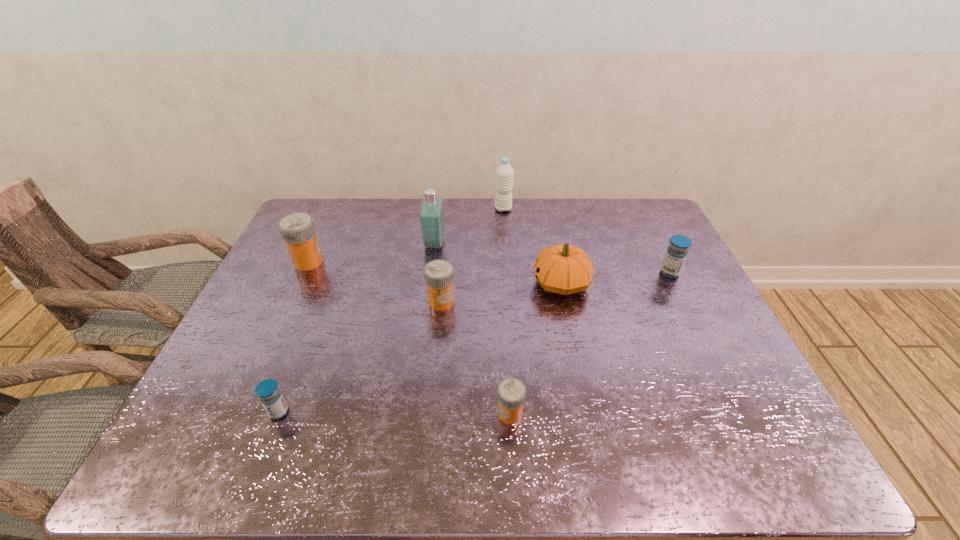
Locate an element on the screen. the farthest object is located at coordinates (504, 177).

Locate an element on the screen. The height and width of the screenshot is (540, 960). water bottle is located at coordinates (504, 177).

Image resolution: width=960 pixels, height=540 pixels. I want to click on perfume, so click(x=432, y=222).

Where is `the leftmost medicine`? The height and width of the screenshot is (540, 960). the leftmost medicine is located at coordinates (297, 230).

The height and width of the screenshot is (540, 960). Identify the location of the farthest orange medicine. (297, 230).

This screenshot has width=960, height=540. What are the coordinates of `gourd` in the screenshot? It's located at (564, 269).

Where is `orange gourd`? The width and height of the screenshot is (960, 540). orange gourd is located at coordinates (564, 269).

The height and width of the screenshot is (540, 960). In order to click on the farther blue medicine in this screenshot , I will do coord(676,253).

Identify the location of the rightmost medicine. Image resolution: width=960 pixels, height=540 pixels. (676, 253).

Image resolution: width=960 pixels, height=540 pixels. What are the coordinates of `the second biggest orange medicine` in the screenshot? It's located at (439, 274).